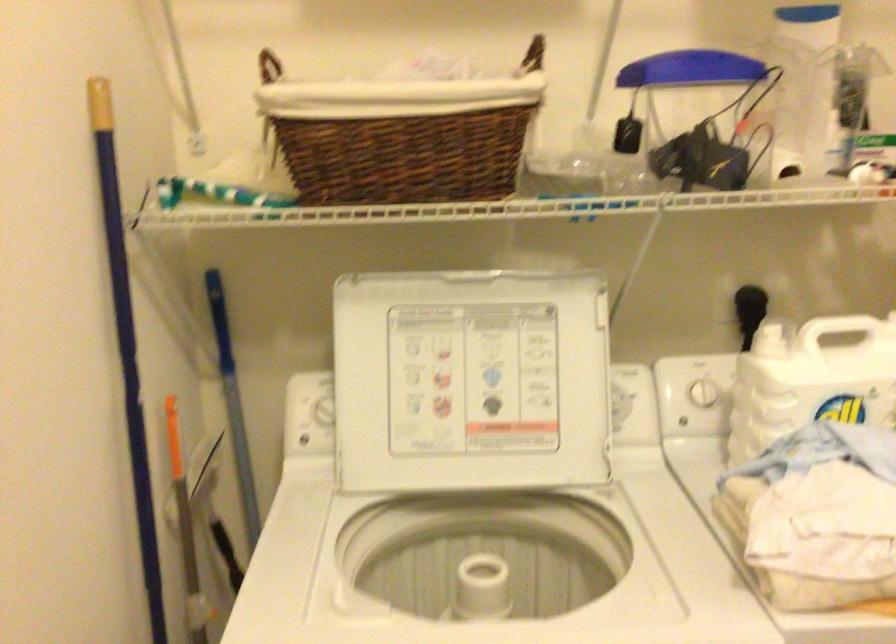
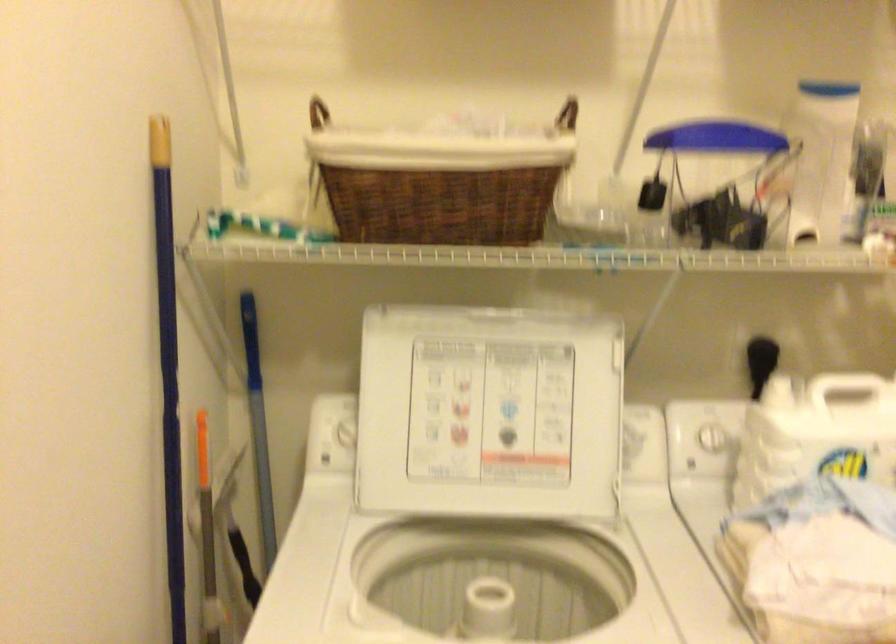
Locate, in the second image, the point that corresponds to point 268,73 in the first image.

(317, 113)